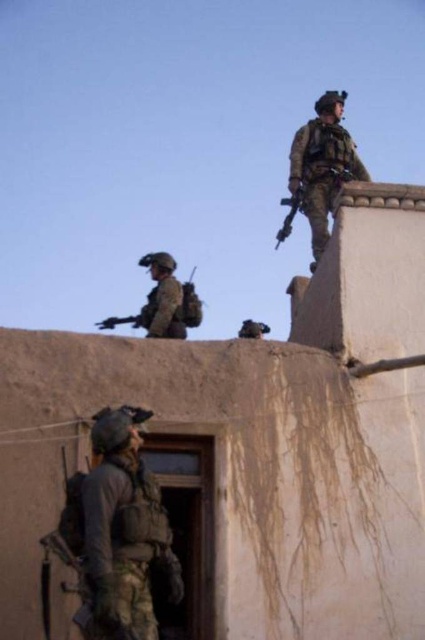
Question: Which point is closer to the camera?

Choices:
 (A) (333, 118)
 (B) (170, 292)
 (C) (277, 236)

Answer: (B)

Question: Can you confirm if camouflage fabric uniform at lower left is wider than matte black rifle at upper right?

Choices:
 (A) no
 (B) yes

Answer: (B)

Question: Among these points, which one is farthest from the camera?

Choices:
 (A) (311, 269)
 (B) (102, 632)

Answer: (A)

Question: Which of the following is the farthest from the observer?

Choices:
 (A) (150, 598)
 (B) (311, 140)
 (C) (164, 333)
 (D) (294, 204)

Answer: (B)

Question: Is camouflage uniform at upper right above camouflage uniform at center?

Choices:
 (A) no
 (B) yes

Answer: (B)

Question: Can you confirm if camouflage fabric uniform at lower left is bigger than camouflage uniform at upper right?

Choices:
 (A) yes
 (B) no

Answer: (B)